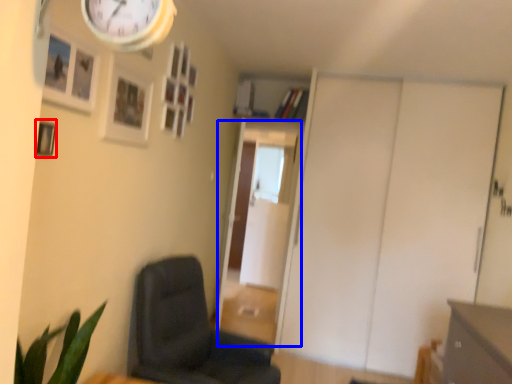
Question: Which object is further to the camera taking this photo, picture frame (highlighted by a red box) or glass door (highlighted by a blue box)?

Choices:
 (A) picture frame
 (B) glass door

Answer: (B)